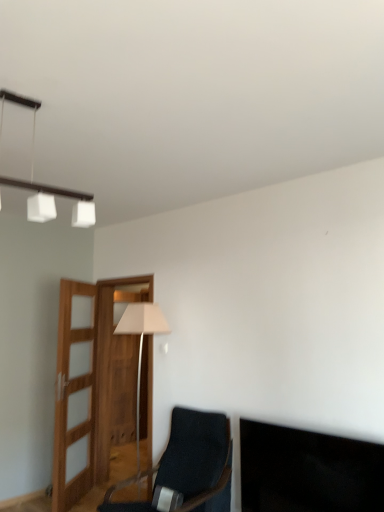
Question: Considering the relative positions of black glossy tv at lower right and white fabric lampshade at center in the image provided, is black glossy tv at lower right behind white fabric lampshade at center?

Choices:
 (A) yes
 (B) no

Answer: (B)

Question: Can you confirm if black glossy tv at lower right is thinner than white fabric lampshade at center?

Choices:
 (A) yes
 (B) no

Answer: (A)

Question: Would you say black glossy tv at lower right is a long distance from white fabric lampshade at center?

Choices:
 (A) no
 (B) yes

Answer: (B)

Question: Is black glossy tv at lower right smaller than white fabric lampshade at center?

Choices:
 (A) no
 (B) yes

Answer: (B)

Question: Is black glossy tv at lower right surrounding white fabric lampshade at center?

Choices:
 (A) yes
 (B) no

Answer: (B)

Question: Is white fabric lampshade at center at the back of black glossy tv at lower right?

Choices:
 (A) yes
 (B) no

Answer: (B)

Question: From a real-world perspective, is white fabric lampshade at center located higher than black glossy tv at lower right?

Choices:
 (A) no
 (B) yes

Answer: (B)

Question: Is the depth of white fabric lampshade at center less than that of black glossy tv at lower right?

Choices:
 (A) no
 (B) yes

Answer: (A)

Question: Is white fabric lampshade at center to the right of black glossy tv at lower right from the viewer's perspective?

Choices:
 (A) yes
 (B) no

Answer: (B)

Question: From the image's perspective, is white fabric lampshade at center on black glossy tv at lower right?

Choices:
 (A) yes
 (B) no

Answer: (A)

Question: Is white fabric lampshade at center not within black glossy tv at lower right?

Choices:
 (A) no
 (B) yes

Answer: (B)

Question: Could you tell me if white fabric lampshade at center is facing black glossy tv at lower right?

Choices:
 (A) no
 (B) yes

Answer: (A)

Question: Does black glossy tv at lower right have a larger size compared to dark blue fabric chair at center?

Choices:
 (A) no
 (B) yes

Answer: (A)